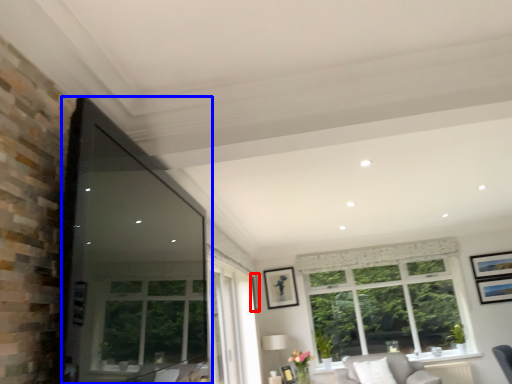
Question: Among these objects, which one is nearest to the camera, picture frame (highlighted by a red box) or window screen (highlighted by a blue box)?

Choices:
 (A) picture frame
 (B) window screen

Answer: (B)